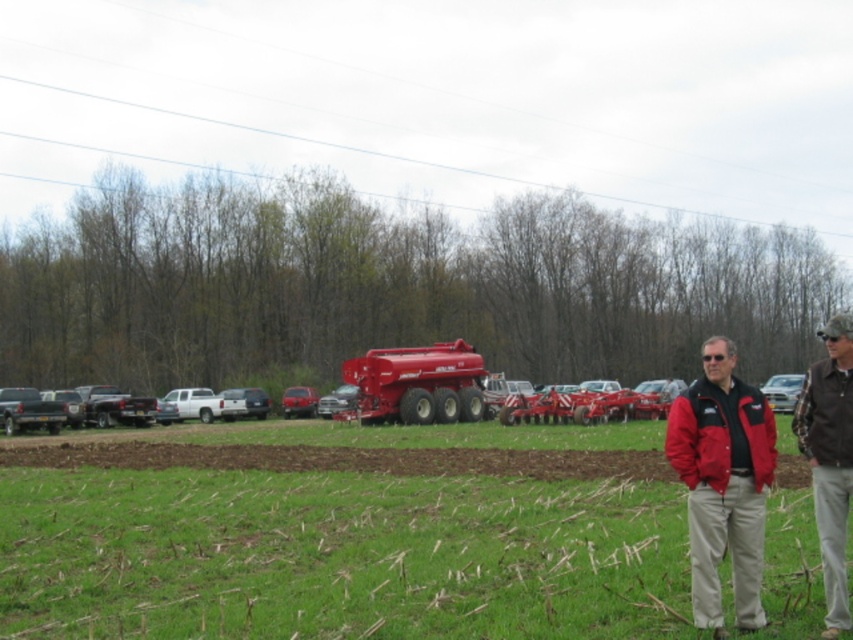
You are a farmer who wants to park both the matte red trailer truck at center and the metallic silver car at center in a single lane that is 3 meters wide. Can both vehicles fit side by side in the lane without overlapping? Please explain your reasoning.

The matte red trailer truck at center is wider than the metallic silver car at center. Since the lane is only 3 meters wide, and the combined width of both vehicles exceeds this limit, they cannot fit side by side without overlapping.